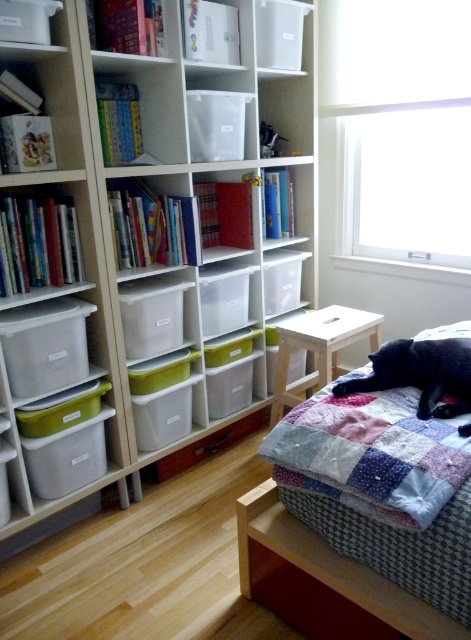
Is patchwork quilt at upper right smaller than matte plastic drawer at lower center?

No.

Is patchwork quilt at upper right below matte plastic drawer at lower center?

Incorrect, patchwork quilt at upper right is not positioned below matte plastic drawer at lower center.

Is point (373, 435) farther from viewer compared to point (162, 477)?

No, it is not.

Image resolution: width=471 pixels, height=640 pixels. What are the coordinates of `patchwork quilt at upper right` in the screenshot? It's located at (371, 454).

Who is lower down, white plastic bookcase at upper left or matte plastic drawer at lower center?

Positioned lower is matte plastic drawer at lower center.

Between point (127, 436) and point (168, 476), which one is positioned in front?

Point (127, 436) is in front.

What are the coordinates of `white plastic bookcase at upper left` in the screenshot? It's located at (154, 250).

Which is above, black fur cat at lower right or light wood stool at center?

light wood stool at center is above.

What are the coordinates of `black fur cat at lower right` in the screenshot? It's located at (421, 372).